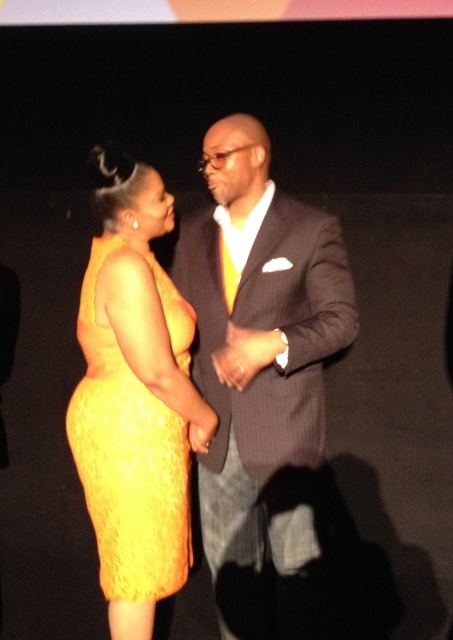
You are a photographer setting up for a group photo. You have a camera with a 1.5 meter wide frame. The two subjects are wearing the matte black suit at center and the yellow lace dress at left. Can both subjects fit within the frame if they stand side by side?

The matte black suit at center is bigger than the yellow lace dress at left. However, the question is about fitting within a 1.5 meter frame. Since the objects are clothing items and their actual sizes aren not specified, we cannot determine if they can fit based on the given information. The description only compares their sizes relative to each other, not their absolute dimensions.

You are a photographer setting up for a portrait. The scene has two people, one wearing a vibrant yellow dress and the other in a matte black suit at center. To ensure both subjects are in focus, you need to know their positions relative to each other. Which subject is positioned closer to the camera?

The matte black suit at center is located at point (x=263, y=380), which is the center of the image. Since the person in the matte black suit is at the center, they are likely closer to the camera compared to the other person in the yellow dress.